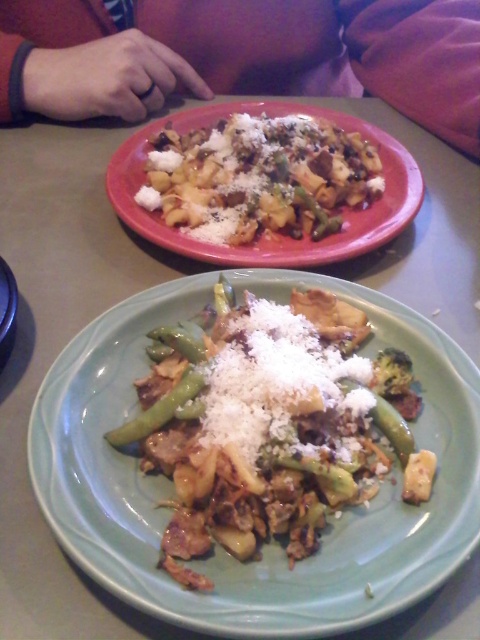
Locate an element on the screen. This screenshot has height=640, width=480. green matte plate at center is located at coordinates [x=272, y=540].

Is green matte plate at center closer to the viewer compared to matte ceramic plate at upper center?

Yes, it is.

Between point (263, 634) and point (383, 209), which one is positioned behind?

Point (383, 209)

Identify the location of green matte plate at center. The width and height of the screenshot is (480, 640). (272, 540).